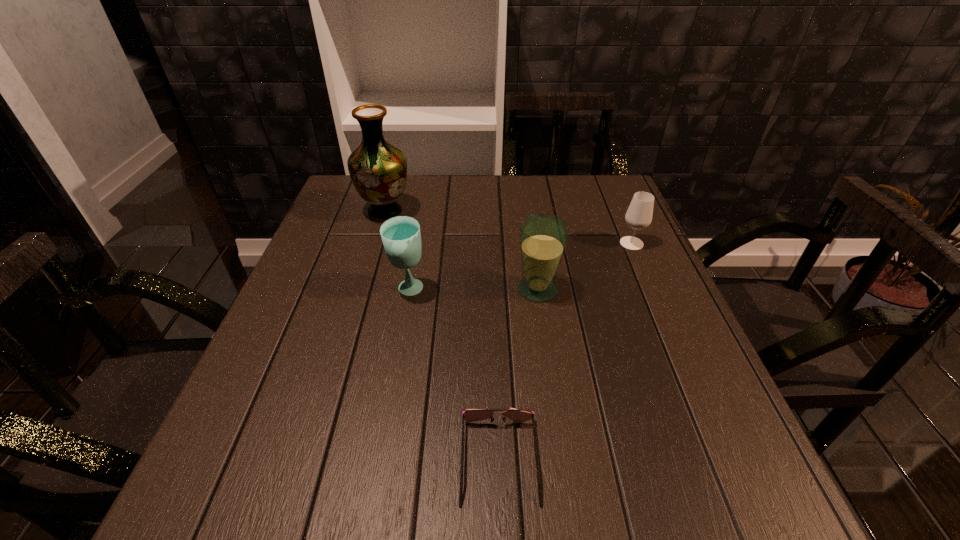
Where is `the tallest object`? Image resolution: width=960 pixels, height=540 pixels. the tallest object is located at coordinates (378, 170).

Where is `the farthest object`? Image resolution: width=960 pixels, height=540 pixels. the farthest object is located at coordinates (378, 170).

The height and width of the screenshot is (540, 960). I want to click on the leftmost glass, so click(x=401, y=237).

Find the location of a particular element. This screenshot has height=540, width=960. the second glass from right to left is located at coordinates (543, 237).

Where is `the second farthest object`? The width and height of the screenshot is (960, 540). the second farthest object is located at coordinates (639, 214).

In order to click on the shortest glass in this screenshot , I will do `click(639, 214)`.

Where is `sunglasses`? This screenshot has height=540, width=960. sunglasses is located at coordinates (471, 415).

The height and width of the screenshot is (540, 960). Identify the location of the shortest object. (471, 415).

Find the location of a particular element. vacant region located on the right of the tallest object is located at coordinates (489, 212).

Locate an element on the screen. The width and height of the screenshot is (960, 540). vacant space situated 0.180m on the front of the leftmost glass is located at coordinates (394, 371).